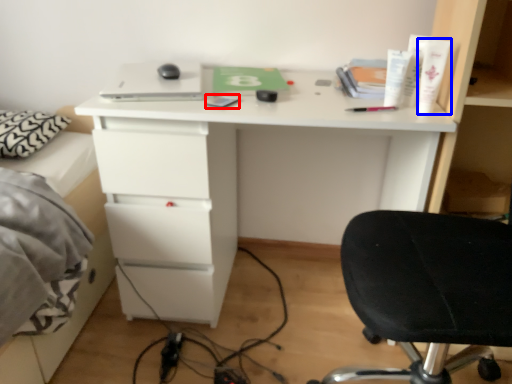
Question: Which object is further to the camera taking this photo, notepad (highlighted by a red box) or toiletry (highlighted by a blue box)?

Choices:
 (A) notepad
 (B) toiletry

Answer: (A)